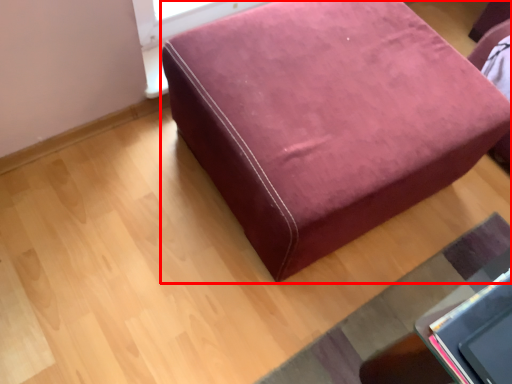
Question: Considering the relative positions of furniture (annotated by the red box) and mat in the image provided, where is furniture (annotated by the red box) located with respect to the staircase?

Choices:
 (A) right
 (B) left

Answer: (B)